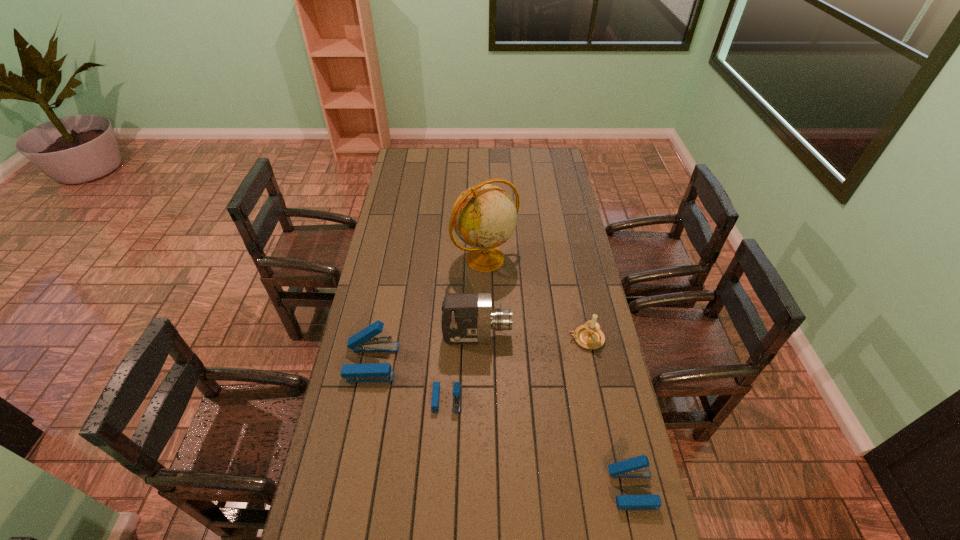
In order to click on the leftmost stapler in this screenshot , I will do `click(364, 341)`.

I want to click on the leftmost object, so click(x=364, y=341).

I want to click on the shortest stapler, so click(436, 385).

Identify the location of the second stapler from right to left. coord(436,385).

Find the location of a particular element. the second shortest stapler is located at coordinates (637, 467).

In order to click on the nearest stapler in this screenshot , I will do `click(637, 467)`.

The width and height of the screenshot is (960, 540). What are the coordinates of `the farthest object` in the screenshot? It's located at (484, 216).

The height and width of the screenshot is (540, 960). In order to click on the tallest object in this screenshot , I will do `click(484, 216)`.

Image resolution: width=960 pixels, height=540 pixels. I want to click on camcorder, so click(x=467, y=318).

Identify the location of candle holder. (589, 336).